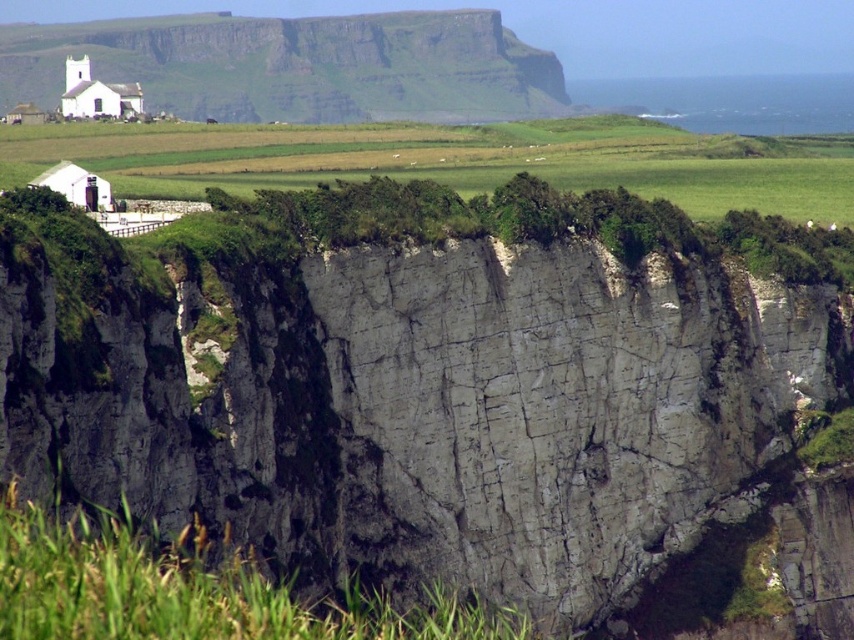
You are standing at the base of the rugged cliffs in the image and want to reach the point marked at coordinates point (41, 333). Given that your maximum walking distance is 200 feet, will you be able to reach it without exceeding your limit?

The distance between you and the point (41, 333) is 243.80 feet, which exceeds your maximum walking distance of 200 feet. Therefore, you will not be able to reach it without exceeding your limit.

You are a hiker standing at the base of the cliffs and want to reach the white stone cliff at upper left. Which direction should you move relative to the gray rough cliff at center?

To reach the white stone cliff at upper left, you should move to the left side of the gray rough cliff at center since the gray rough cliff at center is positioned on the right side of the white stone cliff at upper left.